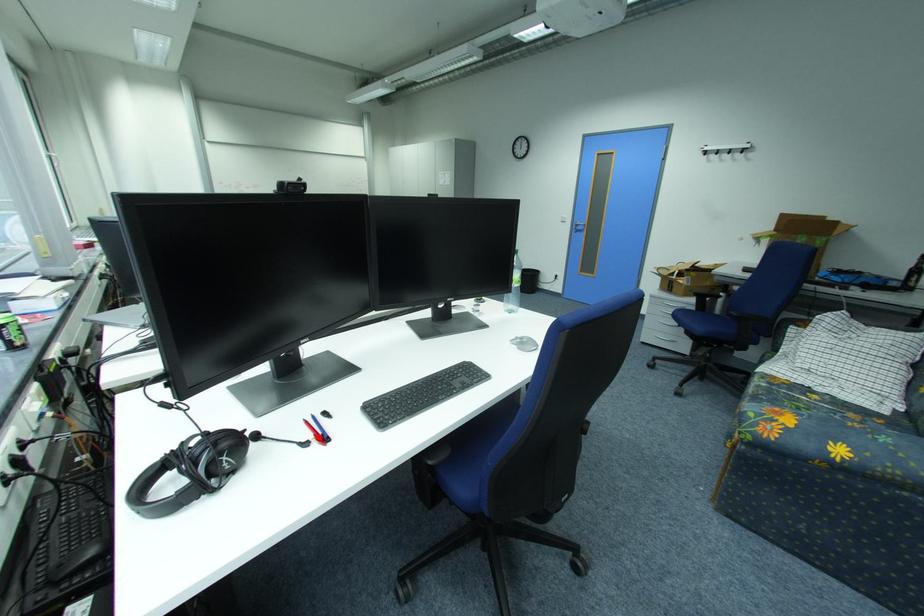
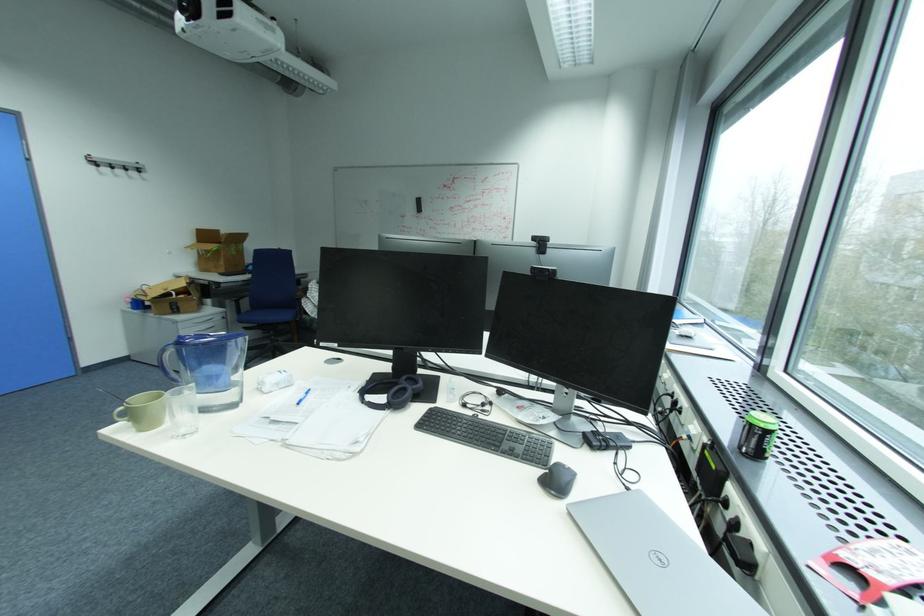
Question: I am providing you with two images of the same scene from different viewpoints. A red point is marked on the first image. At the location where the point appears in image 1, is it still visible in image 2?

Choices:
 (A) Yes
 (B) No

Answer: (B)